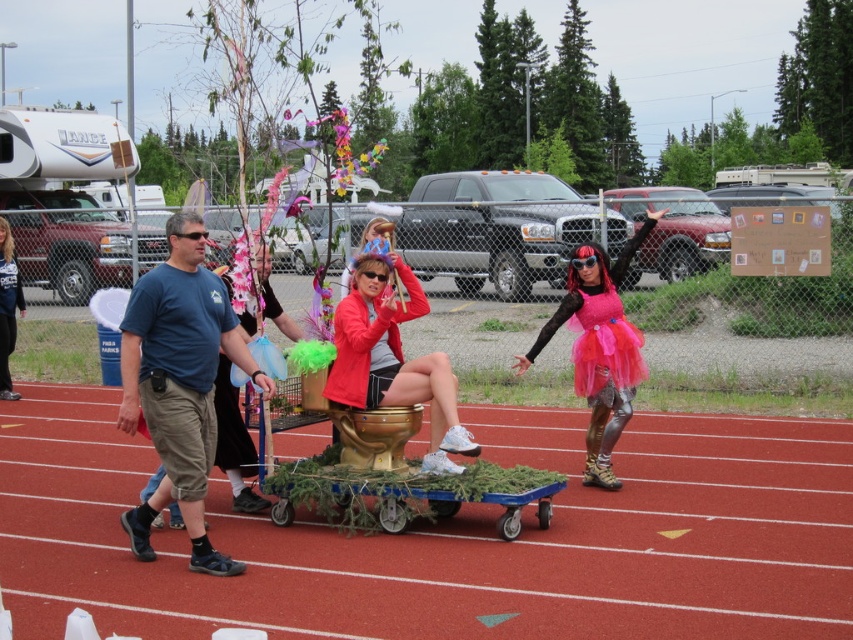
Can you confirm if red rubber track at center is taller than gold metallic toilet at center?

No, red rubber track at center is not taller than gold metallic toilet at center.

Is red rubber track at center further to the viewer compared to gold metallic toilet at center?

No, it is not.

At what (x,y) coordinates should I click in order to perform the action: click on red rubber track at center. Please return your answer as a coordinate pair (x, y). The image size is (853, 640). Looking at the image, I should click on (451, 538).

Does gold metallic toilet at center have a larger size compared to pink tulle skirt at center?

Incorrect, gold metallic toilet at center is not larger than pink tulle skirt at center.

Between gold metallic toilet at center and pink tulle skirt at center, which one is positioned higher?

pink tulle skirt at center is higher up.

This screenshot has width=853, height=640. I want to click on gold metallic toilet at center, so click(x=393, y=358).

The height and width of the screenshot is (640, 853). I want to click on gold metallic toilet at center, so click(x=393, y=358).

Measure the distance between blue cotton t-shirt at left and pink tulle skirt at center.

A distance of 2.70 meters exists between blue cotton t-shirt at left and pink tulle skirt at center.

Between blue cotton t-shirt at left and pink tulle skirt at center, which one appears on the left side from the viewer's perspective?

blue cotton t-shirt at left is more to the left.

Who is more distant from viewer, (230,356) or (602,369)?

Point (602,369)

Locate an element on the screen. blue cotton t-shirt at left is located at coordinates (178, 384).